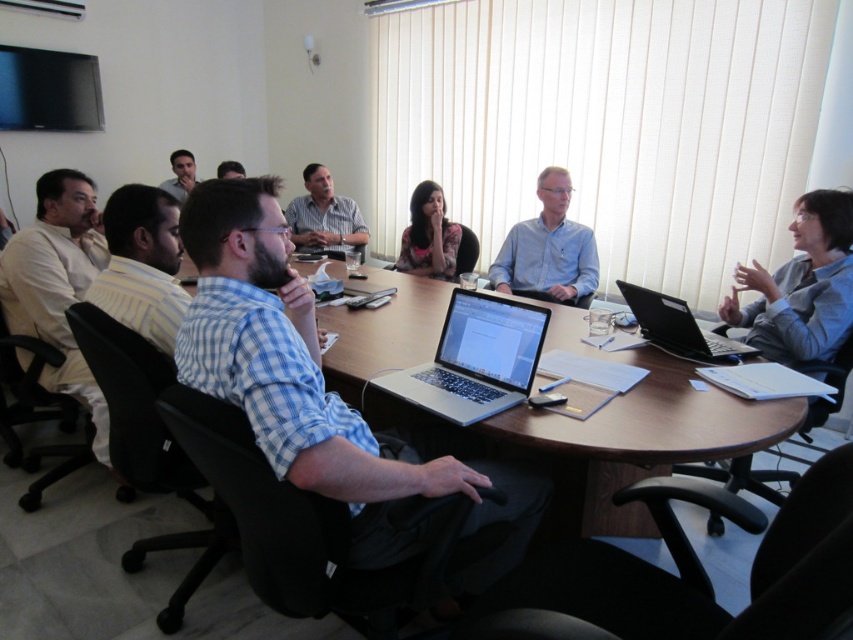
Is silver metallic laptop at center wider than bearded man at center?

Yes.

This screenshot has width=853, height=640. What do you see at coordinates (474, 358) in the screenshot? I see `silver metallic laptop at center` at bounding box center [474, 358].

Describe the element at coordinates (474, 358) in the screenshot. I see `silver metallic laptop at center` at that location.

The width and height of the screenshot is (853, 640). In order to click on silver metallic laptop at center in this screenshot , I will do `click(474, 358)`.

Does silver metallic laptop at center have a greater width compared to matte black shirt at upper left?

Yes.

Describe the element at coordinates (474, 358) in the screenshot. I see `silver metallic laptop at center` at that location.

Where is `silver metallic laptop at center`? silver metallic laptop at center is located at coordinates (474, 358).

Image resolution: width=853 pixels, height=640 pixels. In order to click on silver metallic laptop at center in this screenshot , I will do `click(474, 358)`.

Can you confirm if blue plaid shirt at center is bigger than light brown textured shirt at center?

Yes, blue plaid shirt at center is bigger than light brown textured shirt at center.

Is point (405, 545) closer to viewer compared to point (302, 221)?

Yes, point (405, 545) is in front of point (302, 221).

Image resolution: width=853 pixels, height=640 pixels. I want to click on blue plaid shirt at center, so click(x=325, y=397).